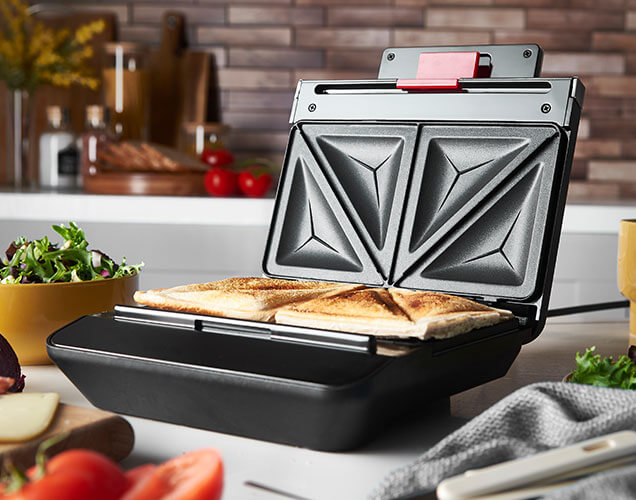
This screenshot has height=500, width=636. Identify the location of brick wall in the background. (303, 37).